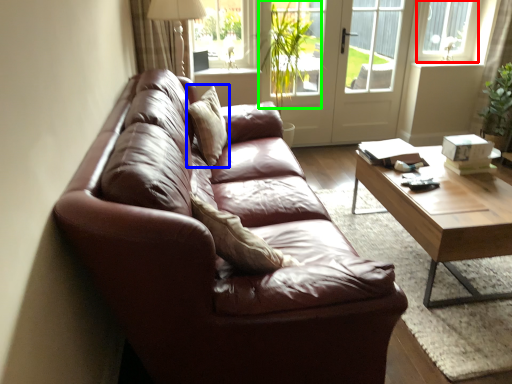
Question: Based on their relative distances, which object is farther from window frame (highlighted by a red box)? Choose from pillow (highlighted by a blue box) and plant (highlighted by a green box).

Choices:
 (A) pillow
 (B) plant

Answer: (A)